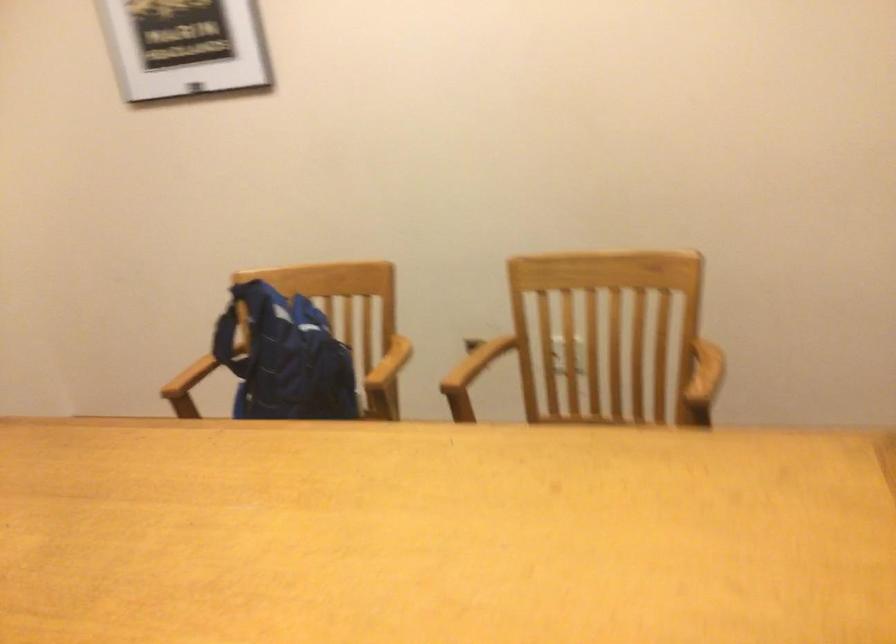
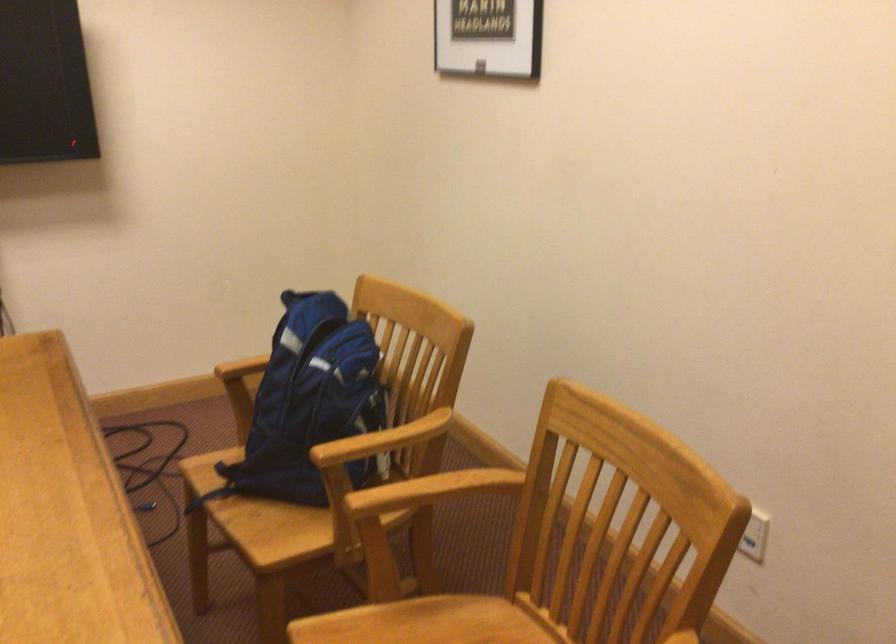
Find the pixel in the second image that matches (x=474, y=360) in the first image.

(436, 488)